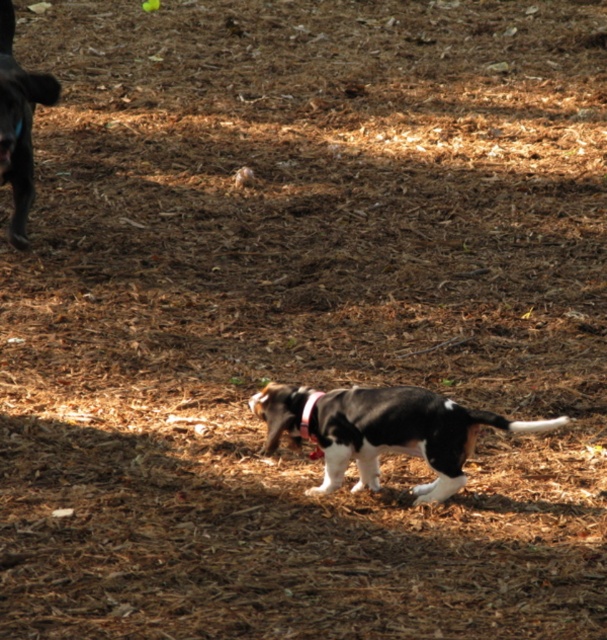
Question: Is black and white fur dog at center in front of shiny black dog at upper left?

Choices:
 (A) yes
 (B) no

Answer: (A)

Question: Considering the real-world distances, which object is farthest from the black and white fur dog at center?

Choices:
 (A) shiny black dog at upper left
 (B) black fabric neckband at center

Answer: (A)

Question: Which object is farther from the camera taking this photo?

Choices:
 (A) shiny black dog at upper left
 (B) black fabric neckband at center

Answer: (A)

Question: Can you confirm if black and white fur dog at center is thinner than shiny black dog at upper left?

Choices:
 (A) yes
 (B) no

Answer: (B)

Question: Is black and white fur dog at center further to camera compared to shiny black dog at upper left?

Choices:
 (A) no
 (B) yes

Answer: (A)

Question: Among these points, which one is farthest from the camera?

Choices:
 (A) (25, 160)
 (B) (427, 458)
 (C) (308, 401)

Answer: (A)